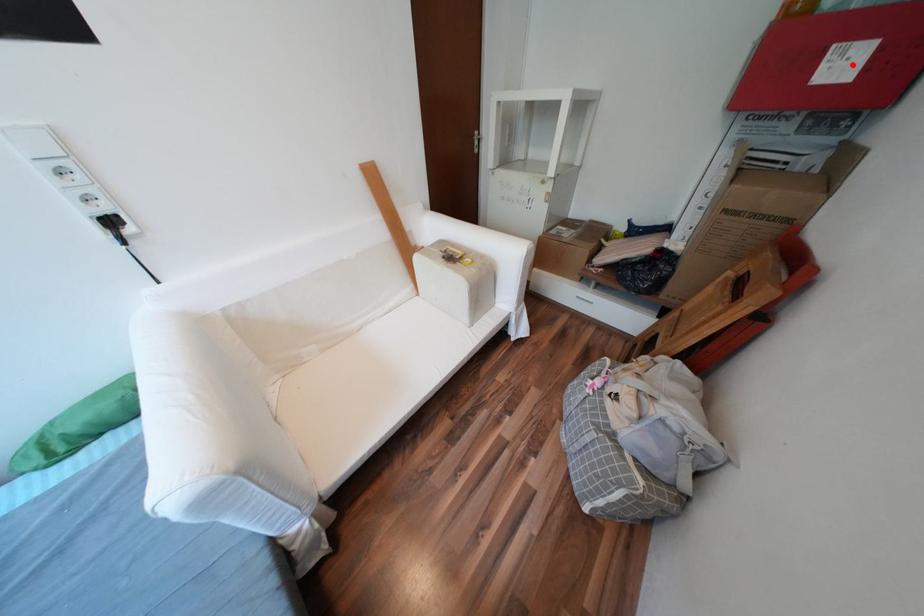
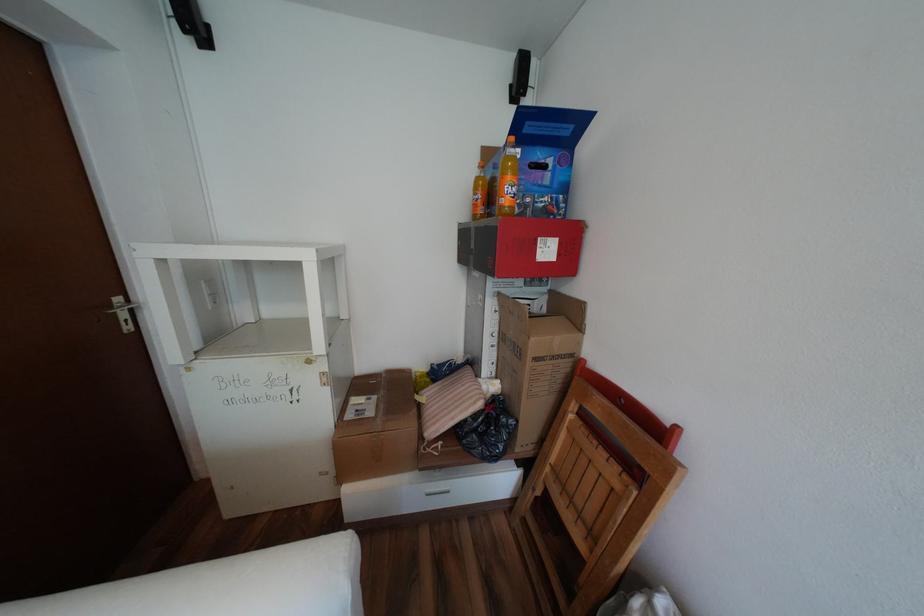
Question: I am providing you with two images of the same scene from different viewpoints. In image1, a red point is highlighted. Considering the same 3D point in image2, which of the following is correct?

Choices:
 (A) It is closer
 (B) It is farther

Answer: (A)